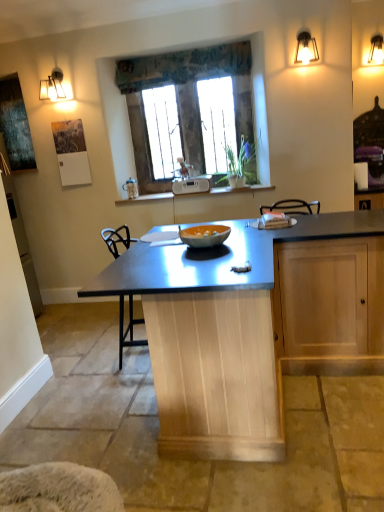
Question: Is metallic blue table at center located outside stone textured window at center?

Choices:
 (A) no
 (B) yes

Answer: (B)

Question: Could you tell me if metallic blue table at center is facing stone textured window at center?

Choices:
 (A) no
 (B) yes

Answer: (A)

Question: Does metallic blue table at center appear on the left side of stone textured window at center?

Choices:
 (A) no
 (B) yes

Answer: (A)

Question: Is metallic blue table at center placed right next to stone textured window at center?

Choices:
 (A) no
 (B) yes

Answer: (A)

Question: Can you confirm if metallic blue table at center is thinner than stone textured window at center?

Choices:
 (A) no
 (B) yes

Answer: (A)

Question: From the image's perspective, is metallic blue table at center beneath stone textured window at center?

Choices:
 (A) no
 (B) yes

Answer: (B)

Question: From the image's perspective, is orange matte glass bowl at center below white plastic radio at center?

Choices:
 (A) yes
 (B) no

Answer: (A)

Question: Does orange matte glass bowl at center appear on the right side of white plastic radio at center?

Choices:
 (A) no
 (B) yes

Answer: (B)

Question: Does orange matte glass bowl at center have a greater height compared to white plastic radio at center?

Choices:
 (A) yes
 (B) no

Answer: (B)

Question: From the image's perspective, is orange matte glass bowl at center over white plastic radio at center?

Choices:
 (A) no
 (B) yes

Answer: (A)

Question: Does orange matte glass bowl at center appear on the left side of white plastic radio at center?

Choices:
 (A) no
 (B) yes

Answer: (A)

Question: Does orange matte glass bowl at center have a smaller size compared to white plastic radio at center?

Choices:
 (A) no
 (B) yes

Answer: (B)

Question: Considering the relative positions of stone textured window at center and metallic wall sconce at upper right in the image provided, is stone textured window at center to the left of metallic wall sconce at upper right from the viewer's perspective?

Choices:
 (A) no
 (B) yes

Answer: (B)